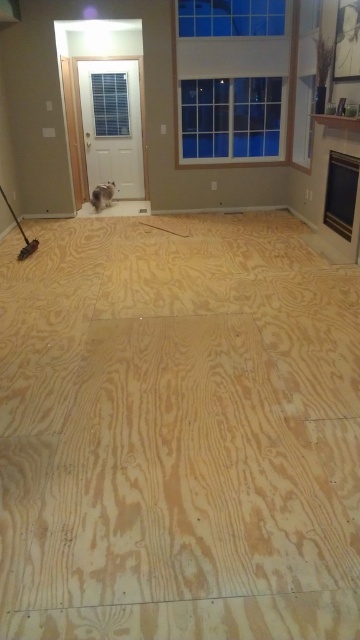
You are a construction worker entering the room and see the natural wood floor at center and the white fluffy cat at center. Which object is located below the other?

The natural wood floor at center is positioned under the white fluffy cat at center, so the floor is below the cat.

You are standing in the center of the room and see the natural wood floor at center and the white fluffy cat at center. Which object is closer to you?

The natural wood floor at center is closer to you because it is in front of the white fluffy cat at center.